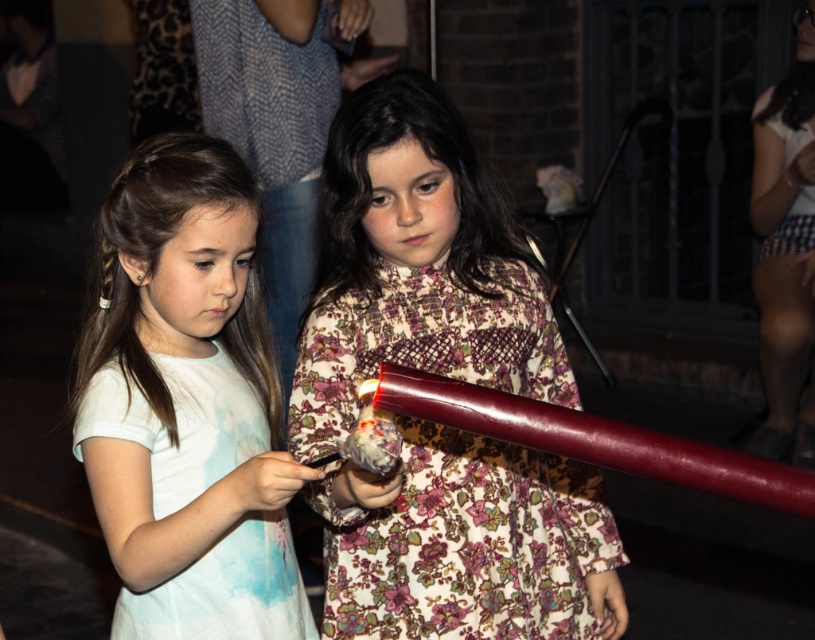
Question: Does floral-patterned fabric dress at center come behind white tie-dye fabric dress at left?

Choices:
 (A) yes
 (B) no

Answer: (B)

Question: Which point is farther to the camera?

Choices:
 (A) (487, 502)
 (B) (108, 388)

Answer: (A)

Question: Which of the following is the closest to the observer?

Choices:
 (A) floral-patterned fabric dress at center
 (B) white tie-dye fabric dress at left

Answer: (A)

Question: Can you confirm if floral-patterned fabric dress at center is positioned above white tie-dye fabric dress at left?

Choices:
 (A) yes
 (B) no

Answer: (A)

Question: Is floral-patterned fabric dress at center below white tie-dye fabric dress at left?

Choices:
 (A) yes
 (B) no

Answer: (B)